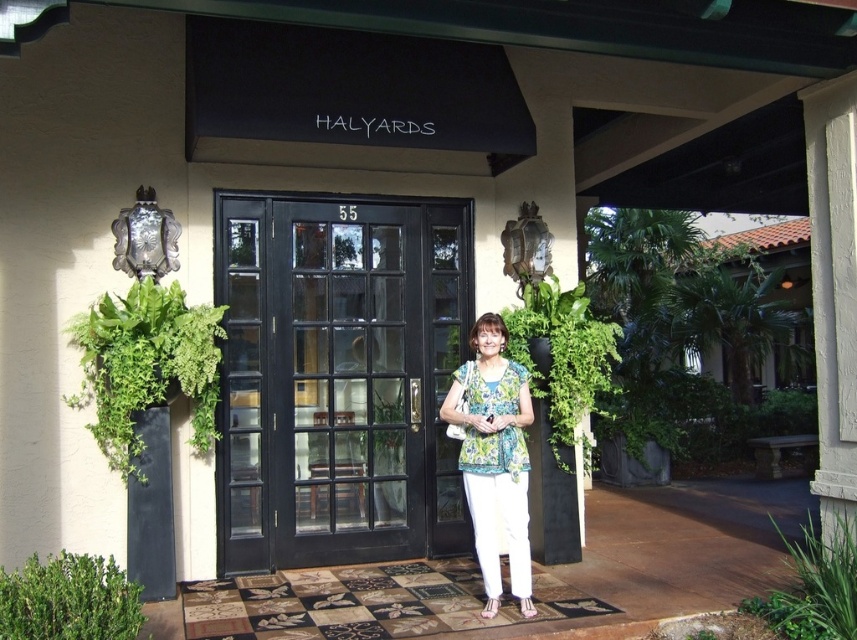
Who is lower down, green leafy plant at left or green leafy plant at lower right?

Positioned lower is green leafy plant at lower right.

The height and width of the screenshot is (640, 857). Describe the element at coordinates (147, 365) in the screenshot. I see `green leafy plant at left` at that location.

The image size is (857, 640). What are the coordinates of `green leafy plant at left` in the screenshot? It's located at (147, 365).

Locate an element on the screen. Image resolution: width=857 pixels, height=640 pixels. black glass door at center is located at coordinates (339, 380).

Who is positioned more to the left, black glass door at center or green leafy bush at lower left?

Positioned to the left is green leafy bush at lower left.

Identify the location of black glass door at center. Image resolution: width=857 pixels, height=640 pixels. (339, 380).

Which is below, floral blouse at center or green leafy plant at lower right?

green leafy plant at lower right is below.

Is floral blouse at center positioned in front of green leafy plant at lower right?

No, it is behind green leafy plant at lower right.

Is point (516, 412) more distant than point (780, 595)?

Yes, it is behind point (780, 595).

This screenshot has width=857, height=640. I want to click on floral blouse at center, so click(494, 458).